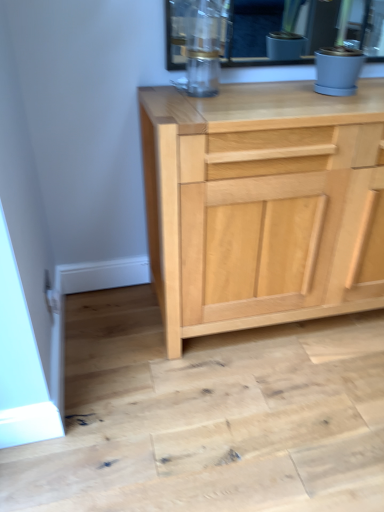
Describe the element at coordinates (257, 202) in the screenshot. I see `natural wood cabinet at center` at that location.

Locate an element on the screen. natural wood cabinet at center is located at coordinates (257, 202).

The image size is (384, 512). Find the location of `natural wood cabinet at center`. natural wood cabinet at center is located at coordinates (257, 202).